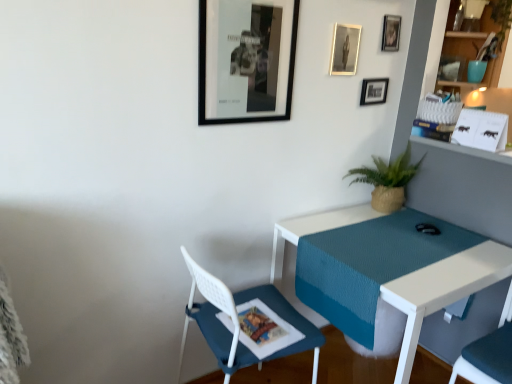
Question: Based on their sizes in the image, would you say teal fabric shelf at upper right is bigger or smaller than black matte picture frame at upper center, which is the 4th picture frame in right-to-left order?

Choices:
 (A) small
 (B) big

Answer: (B)

Question: Is point (472, 56) closer or farther from the camera than point (229, 114)?

Choices:
 (A) farther
 (B) closer

Answer: (A)

Question: Which is nearer to the fabric cushioned chair at lower right, positioned as the 2th chair in left-to-right order?

Choices:
 (A) teal fabric shelf at upper right
 (B) metallic silver photo frame at upper center, which appears as the 3th picture frame when viewed from the right
 (C) metallic silver picture frame at upper center, which ranks as the first picture frame in back-to-front order
 (D) white mesh chair at lower left, arranged as the 1th chair when viewed from the left
 (E) white textured desk at center

Answer: (E)

Question: Estimate the real-world distances between objects in this image. Which object is closer to the metallic silver picture frame at upper right, placed as the 1th picture frame when sorted from right to left?

Choices:
 (A) green woven pot at right
 (B) black matte picture frame at upper center, which is the 4th picture frame in right-to-left order
 (C) teal ceramic vase at upper right
 (D) fabric cushioned chair at lower right, the first chair from the right
 (E) white mesh chair at lower left, arranged as the 1th chair when viewed from the left

Answer: (C)